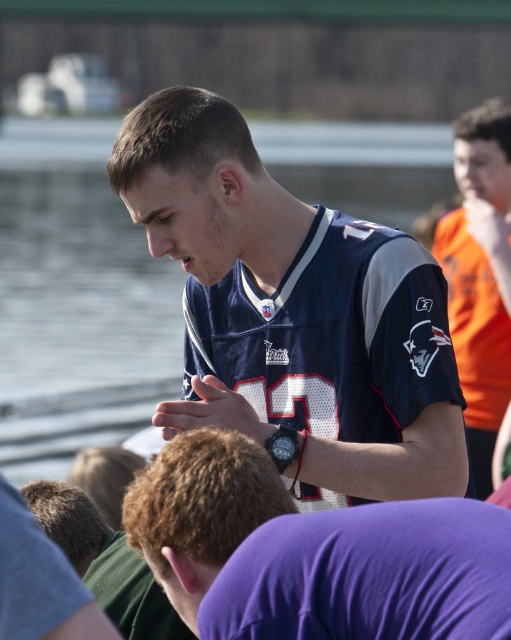
Question: Does navy blue jersey at center appear on the left side of matte jersey at center?

Choices:
 (A) yes
 (B) no

Answer: (A)

Question: Is blue jersey at center positioned before matte blue jersey at center?

Choices:
 (A) yes
 (B) no

Answer: (B)

Question: Considering the real-world distances, which object is farthest from the green jersey at center?

Choices:
 (A) blue jersey at center
 (B) matte blue jersey at center
 (C) navy blue jersey at center

Answer: (A)

Question: Which point is farther to the camera?

Choices:
 (A) 34,540
 (B) 240,428
 (C) 508,212

Answer: (C)

Question: In this image, where is navy blue jersey at center located relative to matte blue jersey at center?

Choices:
 (A) left
 (B) right

Answer: (B)

Question: Which of these objects is positioned farthest from the matte jersey at center?

Choices:
 (A) matte blue jersey at center
 (B) green jersey at center
 (C) navy blue jersey at center

Answer: (C)